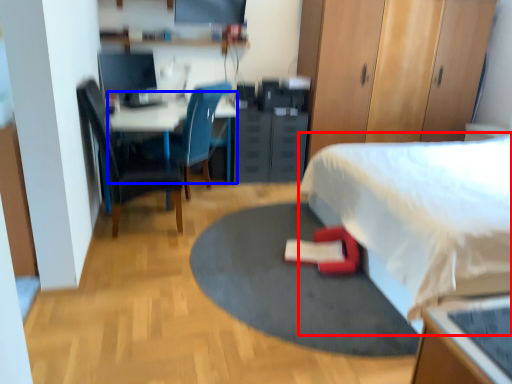
Question: Among these objects, which one is nearest to the camera, bed (highlighted by a red box) or desk (highlighted by a blue box)?

Choices:
 (A) bed
 (B) desk

Answer: (A)